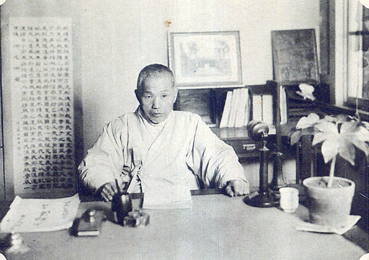
Locate an element on the screen. old school phone is located at coordinates point(260,183).